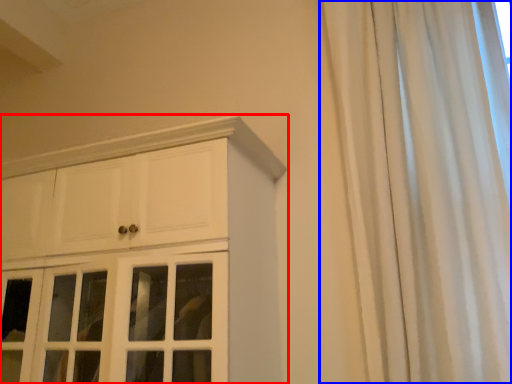
Question: Among these objects, which one is farthest to the camera, cupboard (highlighted by a red box) or curtain (highlighted by a blue box)?

Choices:
 (A) cupboard
 (B) curtain

Answer: (A)